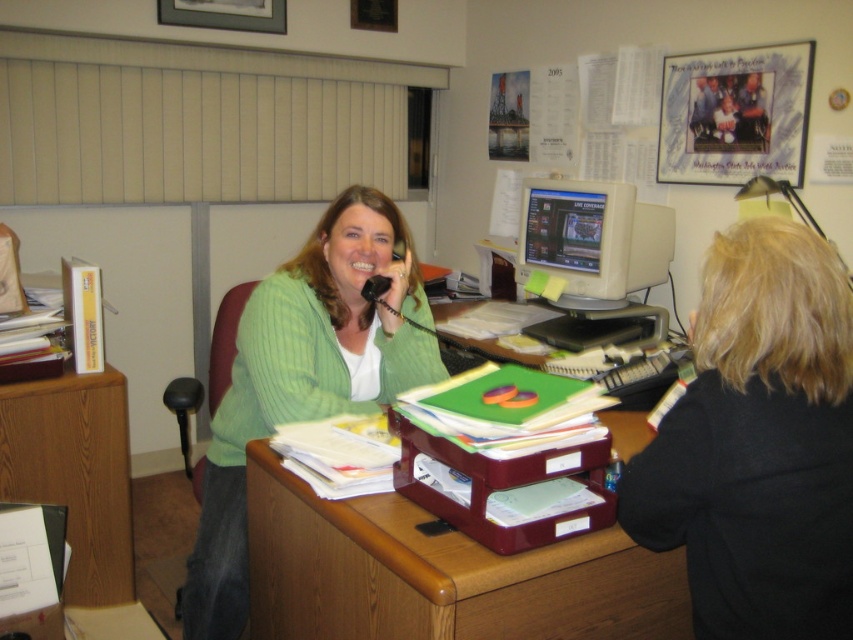
Question: Is black matte jacket at right bigger than white plastic monitor at center?

Choices:
 (A) yes
 (B) no

Answer: (B)

Question: Among these objects, which one is farthest from the camera?

Choices:
 (A) black plastic microphone at upper center
 (B) brown wood desk at center
 (C) green knitted sweater at center
 (D) white plastic monitor at center

Answer: (D)

Question: Is green knitted sweater at center bigger than wooden file cabinet at left?

Choices:
 (A) no
 (B) yes

Answer: (B)

Question: Which object is closer to the camera taking this photo?

Choices:
 (A) green knitted sweater at center
 (B) black matte jacket at right
 (C) black plastic microphone at upper center
 (D) wooden file cabinet at left

Answer: (B)

Question: Does brown wood desk at center have a lesser width compared to black plastic microphone at upper center?

Choices:
 (A) no
 (B) yes

Answer: (A)

Question: Based on their relative distances, which object is nearer to the black plastic microphone at upper center?

Choices:
 (A) white plastic monitor at center
 (B) brown wood desk at center
 (C) wooden file cabinet at left

Answer: (B)